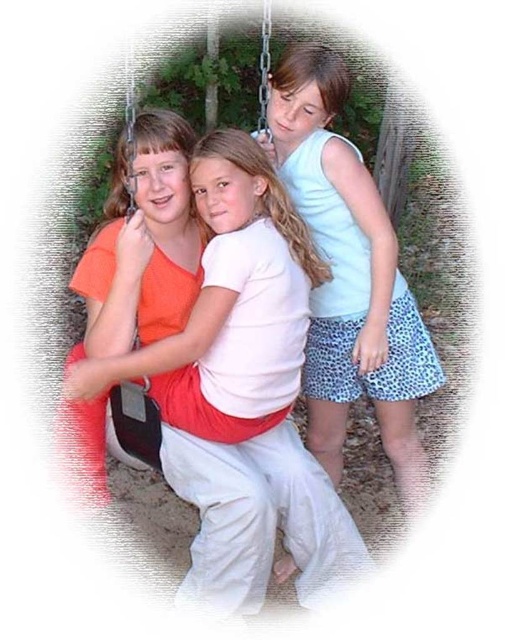
Consider the image. Who is higher up, white cotton shirt at center or matte red swing at center?

white cotton shirt at center

Does point (264, 188) come behind point (141, 449)?

No, (264, 188) is closer to viewer.

Where is `white cotton shirt at center`? The width and height of the screenshot is (508, 640). white cotton shirt at center is located at coordinates (241, 388).

Does point (351, 176) come in front of point (147, 404)?

No, it is not.

Who is positioned more to the right, light blue fabric shorts at center or matte red swing at center?

light blue fabric shorts at center

You are a GUI agent. You are given a task and a screenshot of the screen. Output one action in this format:
    pyautogui.click(x=<x>, y=<y>)
    Task: Click on the light blue fabric shorts at center
    The width and height of the screenshot is (508, 640).
    Given the screenshot: What is the action you would take?
    pyautogui.click(x=348, y=275)

Between white cotton shirt at center and light blue fabric shorts at center, which one has more height?

light blue fabric shorts at center is taller.

Does white cotton shirt at center lie behind light blue fabric shorts at center?

No, white cotton shirt at center is closer to the viewer.

Locate an element on the screen. This screenshot has width=508, height=640. white cotton shirt at center is located at coordinates (241, 388).